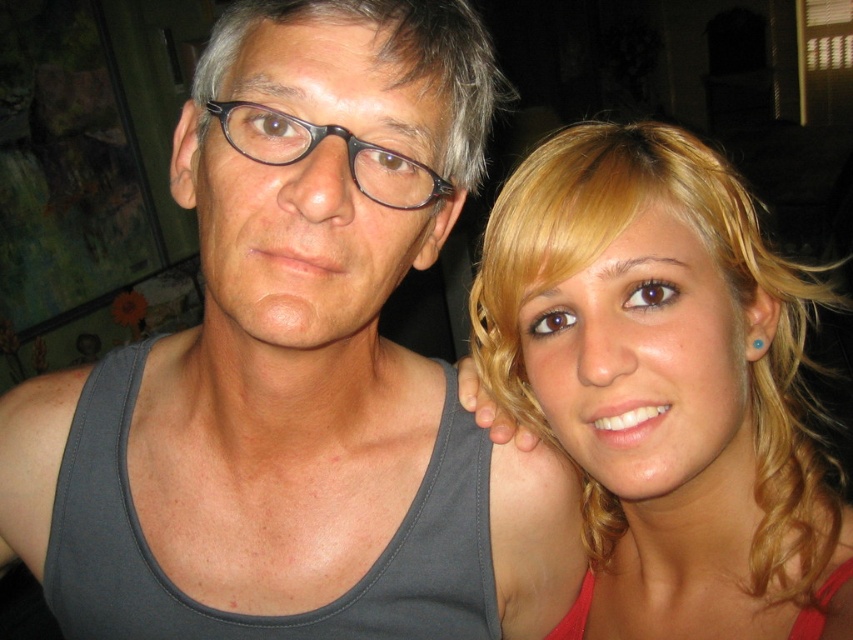
Question: Can you confirm if gray matte tank top at left is bigger than blonde hair at right?

Choices:
 (A) yes
 (B) no

Answer: (B)

Question: Which object appears closest to the camera in this image?

Choices:
 (A) gray matte tank top at left
 (B) blonde hair at right
 (C) matte black glasses at center

Answer: (A)

Question: Can you confirm if gray matte tank top at left is positioned to the left of matte black glasses at center?

Choices:
 (A) yes
 (B) no

Answer: (A)

Question: Does blonde hair at right have a lesser width compared to matte black glasses at center?

Choices:
 (A) yes
 (B) no

Answer: (B)

Question: Which point is closer to the camera?

Choices:
 (A) (245, 138)
 (B) (531, 618)
 (C) (660, 344)

Answer: (A)

Question: Which object is closer to the camera taking this photo?

Choices:
 (A) matte black glasses at center
 (B) gray matte tank top at left

Answer: (B)